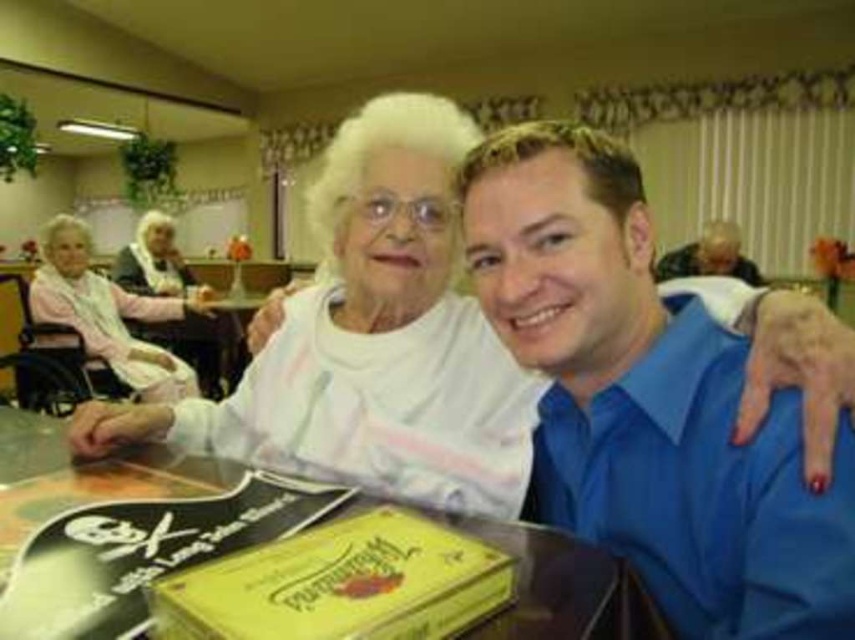
Question: Considering the relative positions of yellow matte book at lower center and yellow paper at center in the image provided, where is yellow matte book at lower center located with respect to yellow paper at center?

Choices:
 (A) above
 (B) below

Answer: (B)

Question: Is yellow matte book at lower center smaller than pink fabric at left?

Choices:
 (A) no
 (B) yes

Answer: (B)

Question: Which point is farther to the camera?

Choices:
 (A) (681, 355)
 (B) (453, 618)
 (C) (429, 241)

Answer: (C)

Question: Among these points, which one is farthest from the camera?

Choices:
 (A) (667, 273)
 (B) (329, 472)
 (C) (27, 442)
 (D) (703, 532)

Answer: (A)

Question: Which object is positioned farthest from the pink fabric at left?

Choices:
 (A) blue smooth shirt at upper right
 (B) white matte/soft fabric at center
 (C) blue shirt at upper right

Answer: (A)

Question: Does white matte/soft fabric at center lie behind blue shirt at upper right?

Choices:
 (A) yes
 (B) no

Answer: (B)